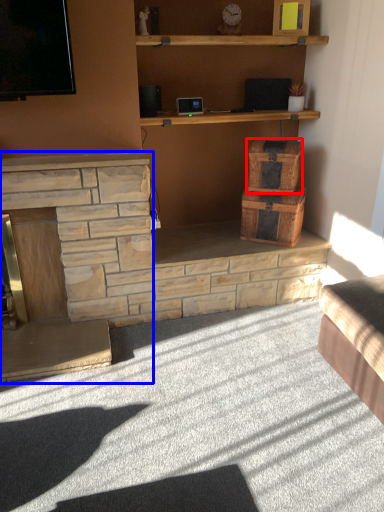
Question: Which of the following is the farthest to the observer, crate (highlighted by a red box) or fireplace (highlighted by a blue box)?

Choices:
 (A) crate
 (B) fireplace

Answer: (A)